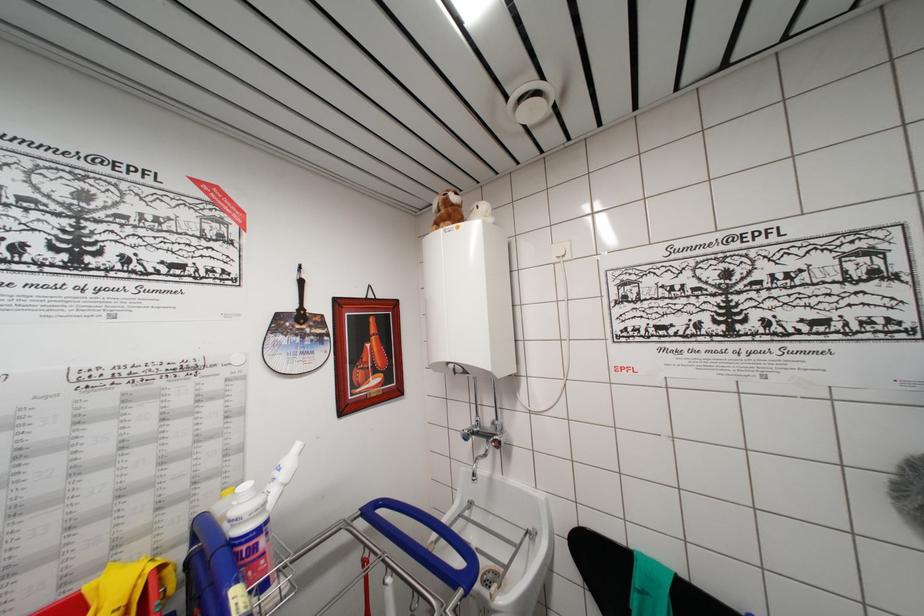
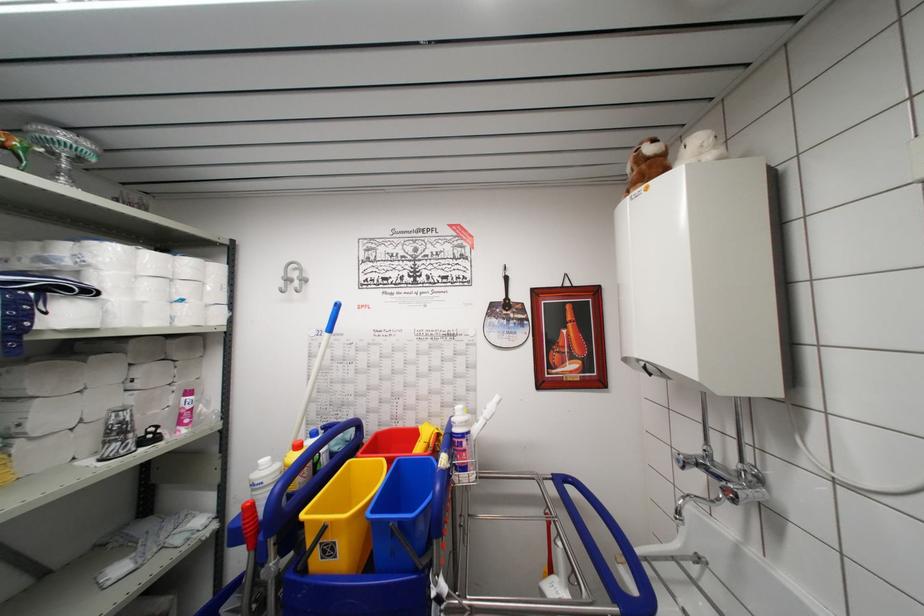
In the second image, find the point that corresponds to (154,572) in the first image.

(439, 436)